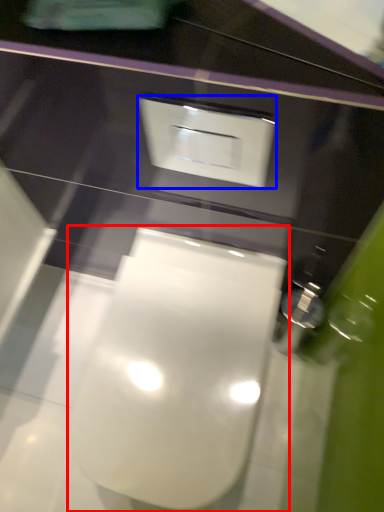
Question: Among these objects, which one is farthest to the camera, toilet (highlighted by a red box) or square (highlighted by a blue box)?

Choices:
 (A) toilet
 (B) square

Answer: (A)